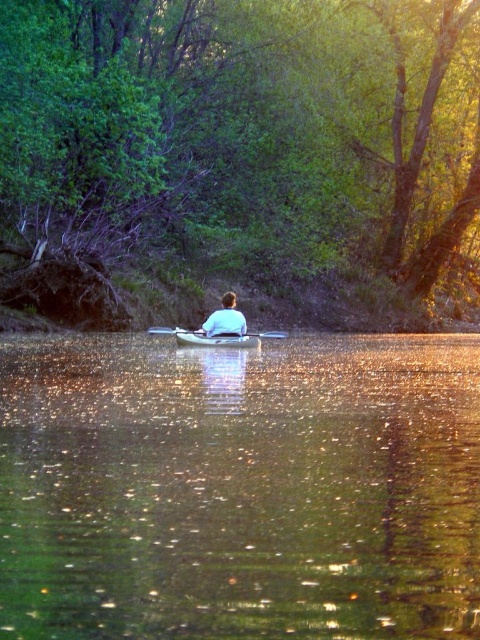
Question: Is smooth gray canoe at center positioned behind white plastic paddle at center?

Choices:
 (A) yes
 (B) no

Answer: (B)

Question: Is green reflective water at center thinner than white plastic paddle at center?

Choices:
 (A) no
 (B) yes

Answer: (A)

Question: Is smooth gray canoe at center positioned at the back of white plastic paddle at center?

Choices:
 (A) yes
 (B) no

Answer: (B)

Question: Which of these objects is positioned farthest from the green leafy tree at center?

Choices:
 (A) white cotton shirt at center
 (B) smooth gray canoe at center
 (C) white plastic paddle at center

Answer: (A)

Question: Which of the following is the farthest from the observer?

Choices:
 (A) white plastic paddle at center
 (B) white cotton shirt at center
 (C) green reflective water at center

Answer: (A)

Question: Which point is farther from the camera taking this photo?

Choices:
 (A) (274, 333)
 (B) (177, 241)
 (C) (336, 468)
 (D) (222, 342)

Answer: (B)